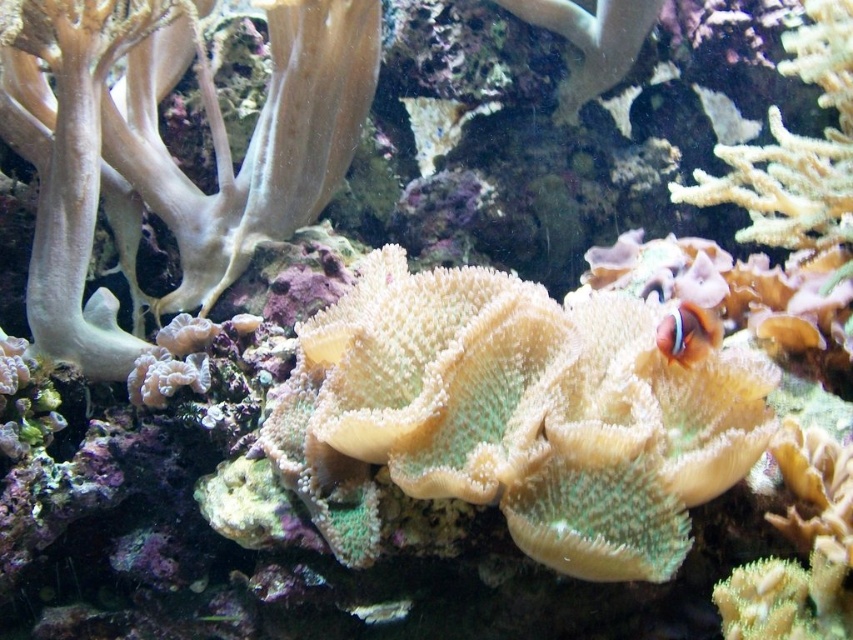
Question: Which of the following is the closest to the observer?

Choices:
 (A) soft coral at center
 (B) orange and white striped fish at center-right

Answer: (A)

Question: Which of the following is the farthest from the observer?

Choices:
 (A) soft coral at center
 (B) orange and white striped fish at center-right

Answer: (B)

Question: From the image, what is the correct spatial relationship of soft coral at center in relation to orange and white striped fish at center-right?

Choices:
 (A) left
 (B) right

Answer: (A)

Question: Does soft coral at center appear over orange and white striped fish at center-right?

Choices:
 (A) no
 (B) yes

Answer: (A)

Question: Where is soft coral at center located in relation to orange and white striped fish at center-right in the image?

Choices:
 (A) below
 (B) above

Answer: (A)